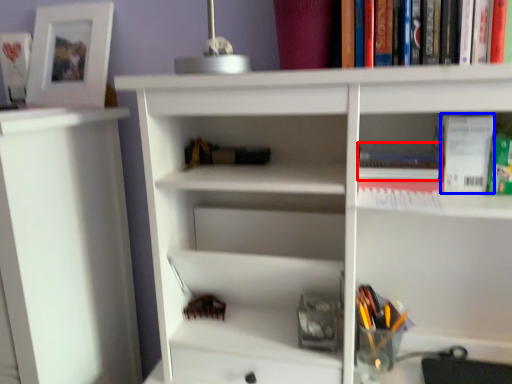
Question: Which of the following is the farthest to the observer, book (highlighted by a red box) or paperback book (highlighted by a blue box)?

Choices:
 (A) book
 (B) paperback book

Answer: (A)